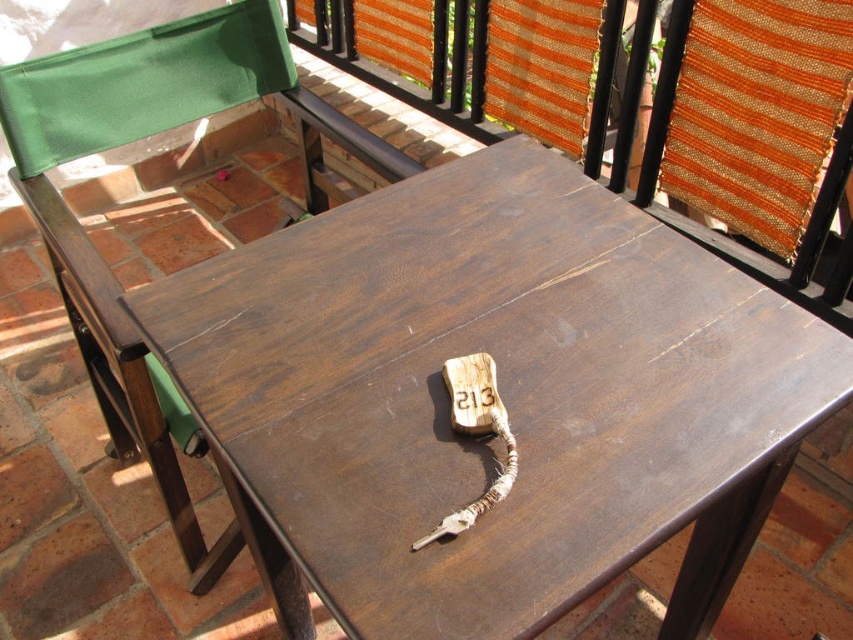
You are a guest at a hotel and need to find your room key. You see the dark wood keychain at center and the green fabric cushion at upper left. How far apart are these two items?

The dark wood keychain at center and the green fabric cushion at upper left are 14.41 inches apart.

You are a guest at a hotel and you found a dark wood keychain at center and a green fabric cushion at upper left on the table. Which object is shorter in height?

The dark wood keychain at center is shorter than the green fabric cushion at upper left.

You are standing at the edge of the patio near the railing and want to place a small potted plant between the two points marked as point (320, 573) and point (128, 397). Which point should the plant be closer to so it is positioned in front of the other point?

The plant should be closer to point (128, 397) because point (320, 573) is in front of point (128, 397), so placing the plant near the latter would position it behind the former.